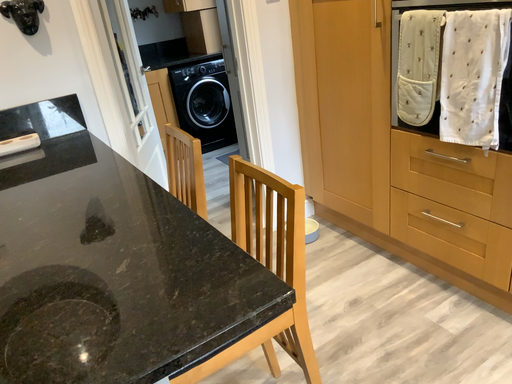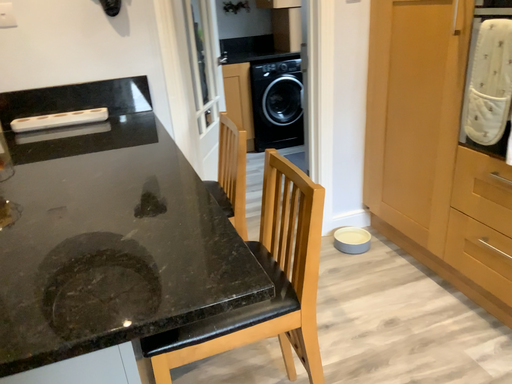
Question: Which way did the camera rotate in the video?

Choices:
 (A) rotated right
 (B) rotated left

Answer: (B)